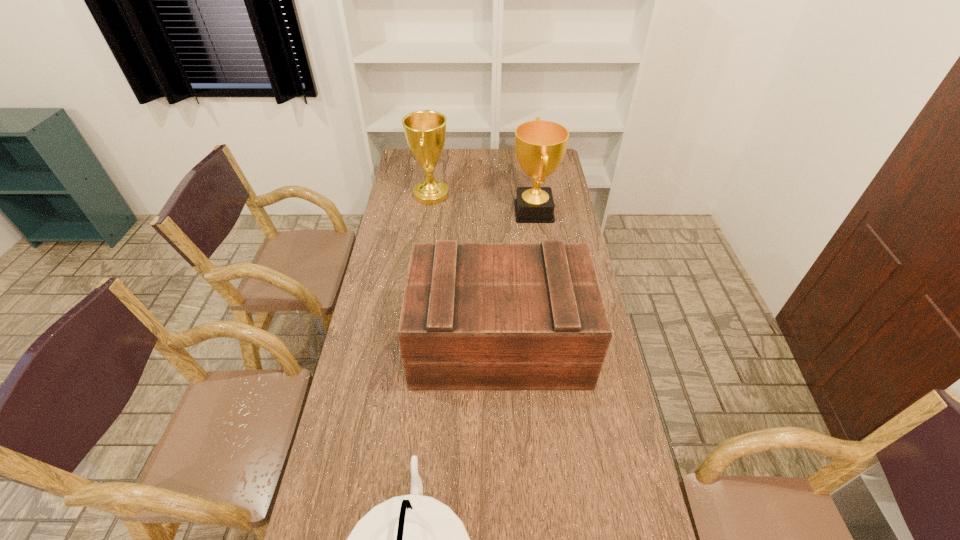
This screenshot has height=540, width=960. I want to click on the right award, so click(x=540, y=145).

Identify the location of the left award. The height and width of the screenshot is (540, 960). (425, 131).

Locate an element on the screen. The height and width of the screenshot is (540, 960). the second nearest object is located at coordinates (475, 316).

Find the location of a particular element. The width and height of the screenshot is (960, 540). vacant space positioned on the front-facing side of the right award is located at coordinates click(436, 212).

In order to click on vacant space located on the front-facing side of the right award in this screenshot , I will do `click(436, 212)`.

Where is `free space located 0.160m on the front-facing side of the right award`? free space located 0.160m on the front-facing side of the right award is located at coordinates (475, 212).

I want to click on free space located by the handles of the left award, so click(x=524, y=195).

The image size is (960, 540). Find the location of `free space located 0.200m on the front of the third farthest object`. free space located 0.200m on the front of the third farthest object is located at coordinates 504,455.

The image size is (960, 540). I want to click on object located at the left edge, so click(425, 131).

I want to click on award that is positioned at the right edge, so click(540, 145).